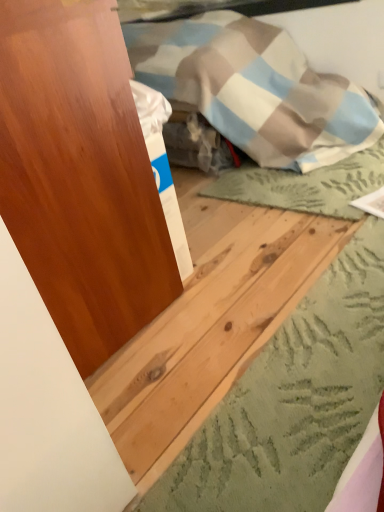
Question: Is natural wood plank at center to the left or to the right of matte wood dresser at left in the image?

Choices:
 (A) right
 (B) left

Answer: (A)

Question: Considering the positions of natural wood plank at center and matte wood dresser at left in the image, is natural wood plank at center taller or shorter than matte wood dresser at left?

Choices:
 (A) short
 (B) tall

Answer: (A)

Question: Looking at their shapes, would you say natural wood plank at center is wider or thinner than matte wood dresser at left?

Choices:
 (A) wide
 (B) thin

Answer: (A)

Question: From the image's perspective, relative to natural wood plank at center, is matte wood dresser at left above or below?

Choices:
 (A) below
 (B) above

Answer: (B)

Question: Looking at their shapes, would you say matte wood dresser at left is wider or thinner than natural wood plank at center?

Choices:
 (A) thin
 (B) wide

Answer: (A)

Question: Does point (54, 207) appear closer or farther from the camera than point (233, 310)?

Choices:
 (A) closer
 (B) farther

Answer: (A)

Question: Do you think matte wood dresser at left is within natural wood plank at center, or outside of it?

Choices:
 (A) inside
 (B) outside

Answer: (B)